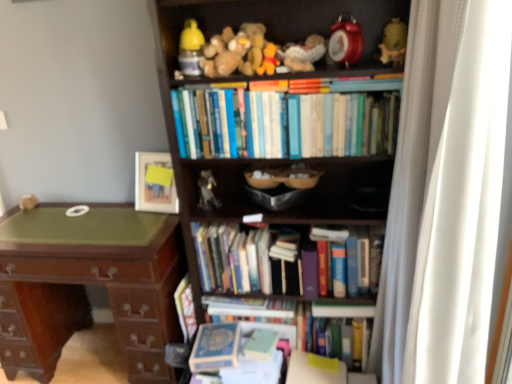
Image resolution: width=512 pixels, height=384 pixels. I want to click on wooden bookcase at center, so click(267, 159).

Locate an element on the screen. This screenshot has width=512, height=384. hardcover books at center, which is the first book from top to bottom is located at coordinates (286, 121).

In order to face metallic silver figurine at center, arranged as the 3th toy when viewed from the left, should I rotate leftwards or rightwards?

To face it directly, rotate left by 6.562 degrees.

This screenshot has width=512, height=384. Find the location of `metallic silver figurine at center, arranged as the 3th toy when viewed from the left`. metallic silver figurine at center, arranged as the 3th toy when viewed from the left is located at coordinates (207, 191).

At what (x,y) coordinates should I click in order to perform the action: click on matte yellow plastic bottle at upper center, which is the second toy from left to right. Please return your answer as a coordinate pair (x, y). The image size is (512, 384). Looking at the image, I should click on (191, 48).

Describe the element at coordinates (346, 41) in the screenshot. I see `shiny red alarm clock at upper right, marked as the second toy in a right-to-left arrangement` at that location.

Where is `brown plush bear at upper center, the 6th toy positioned from the right`? The image size is (512, 384). brown plush bear at upper center, the 6th toy positioned from the right is located at coordinates (224, 53).

Is green polished wood desk at left facing towards yellow rubber duck at upper center, arranged as the sixth toy when viewed from the left?

No.

From the image's perspective, is green polished wood desk at left located above yellow rubber duck at upper center, arranged as the sixth toy when viewed from the left?

No, from the image's perspective, green polished wood desk at left is not on top of yellow rubber duck at upper center, arranged as the sixth toy when viewed from the left.

Does green polished wood desk at left contain yellow rubber duck at upper center, the 4th toy viewed from the right?

Definitely not — yellow rubber duck at upper center, the 4th toy viewed from the right, is not inside green polished wood desk at left.

From their relative heights in the image, would you say fuzzy fabric teddy bear at upper center, marked as the 3th toy in a right-to-left arrangement, is taller or shorter than hardcover books at center, which is the 4th book from top to bottom?

Clearly, fuzzy fabric teddy bear at upper center, marked as the 3th toy in a right-to-left arrangement, is shorter compared to hardcover books at center, which is the 4th book from top to bottom.

Is fuzzy fabric teddy bear at upper center, marked as the 3th toy in a right-to-left arrangement, positioned with its back to hardcover books at center, the second book when ordered from bottom to top?

No, hardcover books at center, the second book when ordered from bottom to top, is not at the back of fuzzy fabric teddy bear at upper center, marked as the 3th toy in a right-to-left arrangement.

Does fuzzy fabric teddy bear at upper center, marked as the 3th toy in a right-to-left arrangement, have a lesser width compared to hardcover books at center, which is the 4th book from top to bottom?

Indeed, fuzzy fabric teddy bear at upper center, marked as the 3th toy in a right-to-left arrangement, has a lesser width compared to hardcover books at center, which is the 4th book from top to bottom.

From the image's perspective, which is above, fuzzy fabric teddy bear at upper center, marked as the 3th toy in a right-to-left arrangement, or hardcover books at center, the second book when ordered from bottom to top?

fuzzy fabric teddy bear at upper center, marked as the 3th toy in a right-to-left arrangement.

Based on the photo, measure the distance from yellow rubber duck at upper center, the 4th toy viewed from the right, to hardcover books at center, which is the first book from top to bottom.

The distance of yellow rubber duck at upper center, the 4th toy viewed from the right, from hardcover books at center, which is the first book from top to bottom, is 9.89 inches.

In the scene shown: Between yellow rubber duck at upper center, arranged as the sixth toy when viewed from the left, and hardcover books at center, marked as the fifth book in a bottom-to-top arrangement, which one has more height?

Standing taller between the two is hardcover books at center, marked as the fifth book in a bottom-to-top arrangement.

From the picture: Who is bigger, yellow rubber duck at upper center, arranged as the sixth toy when viewed from the left, or hardcover books at center, which is the first book from top to bottom?

hardcover books at center, which is the first book from top to bottom.

Is yellow rubber duck at upper center, arranged as the sixth toy when viewed from the left, facing away from hardcover books at center, marked as the fifth book in a bottom-to-top arrangement?

No.

Considering the relative sizes of brown plush bear at upper center, the 6th toy positioned from the right, and fuzzy fabric teddy bear at upper center, which is the seventh toy in left-to-right order, in the image provided, is brown plush bear at upper center, the 6th toy positioned from the right, smaller than fuzzy fabric teddy bear at upper center, which is the seventh toy in left-to-right order,?

No.

Are brown plush bear at upper center, the fourth toy in the left-to-right sequence, and fuzzy fabric teddy bear at upper center, which is the seventh toy in left-to-right order, located far from each other?

No, brown plush bear at upper center, the fourth toy in the left-to-right sequence, is not far from fuzzy fabric teddy bear at upper center, which is the seventh toy in left-to-right order.

I want to click on the 3rd toy to the right when counting from the brown plush bear at upper center, the 6th toy positioned from the right, so click(x=304, y=54).

Is brown plush bear at upper center, the 6th toy positioned from the right, positioned beyond the bounds of fuzzy fabric teddy bear at upper center, which is the seventh toy in left-to-right order?

Yes, brown plush bear at upper center, the 6th toy positioned from the right, is outside of fuzzy fabric teddy bear at upper center, which is the seventh toy in left-to-right order.

Considering the relative positions of yellow rubber duck at upper center, the 4th toy viewed from the right, and matte yellow ceramic vase at upper right, positioned as the ninth toy in left-to-right order, in the image provided, is yellow rubber duck at upper center, the 4th toy viewed from the right, to the left of matte yellow ceramic vase at upper right, positioned as the ninth toy in left-to-right order, from the viewer's perspective?

Correct, you'll find yellow rubber duck at upper center, the 4th toy viewed from the right, to the left of matte yellow ceramic vase at upper right, positioned as the ninth toy in left-to-right order.

I want to click on toy that is the 2nd object located behind the yellow rubber duck at upper center, arranged as the sixth toy when viewed from the left, so click(x=394, y=43).

Can you confirm if yellow rubber duck at upper center, the 4th toy viewed from the right, is wider than matte yellow ceramic vase at upper right, the first toy when ordered from right to left?

Incorrect, the width of yellow rubber duck at upper center, the 4th toy viewed from the right, does not surpass that of matte yellow ceramic vase at upper right, the first toy when ordered from right to left.

From the image's perspective, which one is positioned lower, matte wooden picture frame at upper center or fuzzy fabric stuffed animal at upper center, arranged as the fifth toy when viewed from the right?

matte wooden picture frame at upper center appears lower in the image.

How different are the orientations of matte wooden picture frame at upper center and fuzzy fabric stuffed animal at upper center, the 5th toy positioned from the left, in degrees?

7.75 degrees separate the facing orientations of matte wooden picture frame at upper center and fuzzy fabric stuffed animal at upper center, the 5th toy positioned from the left.

Considering the relative positions of matte wooden picture frame at upper center and fuzzy fabric stuffed animal at upper center, the 5th toy positioned from the left, in the image provided, is matte wooden picture frame at upper center behind fuzzy fabric stuffed animal at upper center, the 5th toy positioned from the left,?

Yes, matte wooden picture frame at upper center is behind fuzzy fabric stuffed animal at upper center, the 5th toy positioned from the left.

From the image's perspective, is white fabric curtain at right located above or below hardcover books at center, the 4th book when ordered from bottom to top?

From the image's perspective, white fabric curtain at right appears above hardcover books at center, the 4th book when ordered from bottom to top.

Is white fabric curtain at right facing away from hardcover books at center, the 2th book viewed from the top?

That's not correct — white fabric curtain at right is not looking away from hardcover books at center, the 2th book viewed from the top.

Is white fabric curtain at right far from hardcover books at center, the 4th book when ordered from bottom to top?

white fabric curtain at right is near hardcover books at center, the 4th book when ordered from bottom to top, not far away.

Can you confirm if white fabric curtain at right is smaller than hardcover books at center, the 4th book when ordered from bottom to top?

No, white fabric curtain at right is not smaller than hardcover books at center, the 4th book when ordered from bottom to top.

Where is `the 3rd toy above the green polished wood desk at left (from the image's perspective)`? Image resolution: width=512 pixels, height=384 pixels. the 3rd toy above the green polished wood desk at left (from the image's perspective) is located at coordinates (268, 60).

Image resolution: width=512 pixels, height=384 pixels. Identify the location of book that is the 4th one when counting downward from the fuzzy fabric teddy bear at upper center, which is the seventh toy in left-to-right order (from the image's perspective). (288, 316).

When comparing their distances from shiny red alarm clock at upper right, marked as the second toy in a right-to-left arrangement, does white fabric curtain at right or matte yellow plastic bottle at upper center, which is the second toy from left to right, seem closer?

matte yellow plastic bottle at upper center, which is the second toy from left to right, lies closer to shiny red alarm clock at upper right, marked as the second toy in a right-to-left arrangement, than the other object.

When comparing their distances from brown plush bear at upper center, the 6th toy positioned from the right, does hardcover books at center, the 4th book when ordered from bottom to top, or hardcover books at center, the second book when ordered from bottom to top, seem closer?

hardcover books at center, the 4th book when ordered from bottom to top, lies closer to brown plush bear at upper center, the 6th toy positioned from the right, than the other object.

From the image, which object appears to be farther from wooden bookcase at center, white fabric curtain at right or hardcover books at center, which is the first book from top to bottom?

Among the two, white fabric curtain at right is located further to wooden bookcase at center.

Consider the image. Which object lies nearer to the anchor point shiny red alarm clock at upper right, marked as the second toy in a right-to-left arrangement, matte yellow ceramic vase at upper right, the first toy when ordered from right to left, or green polished wood desk at left?

matte yellow ceramic vase at upper right, the first toy when ordered from right to left.

Looking at the image, which one is located closer to white fabric curtain at right, green polished wood desk at left or hardcover book at center, which appears as the third book when viewed from the top?

hardcover book at center, which appears as the third book when viewed from the top, is closer to white fabric curtain at right.

Which object lies nearer to the anchor point hardcover books at center, which is the 4th book from top to bottom, fuzzy fabric stuffed animal at upper center, the 5th toy positioned from the left, or yellow rubber duck at upper center, the 4th toy viewed from the right?

yellow rubber duck at upper center, the 4th toy viewed from the right, is closer to hardcover books at center, which is the 4th book from top to bottom.

Looking at the image, which one is located further to wooden bookcase at center, matte yellow ceramic vase at upper right, positioned as the ninth toy in left-to-right order, or hardcover books at center, the second book when ordered from bottom to top?

Based on the image, hardcover books at center, the second book when ordered from bottom to top, appears to be further to wooden bookcase at center.

When comparing their distances from metallic silver figurine at center, arranged as the 3th toy when viewed from the left, does matte wooden picture frame at upper center or matte yellow plastic bottle at upper center, which is the second toy from left to right, seem closer?

The object closer to metallic silver figurine at center, arranged as the 3th toy when viewed from the left, is matte wooden picture frame at upper center.

Where is `bookcase between matte yellow ceramic vase at upper right, positioned as the ninth toy in left-to-right order, and hardcover book at center, which is counted as the third book, starting from the bottom, from top to bottom`? This screenshot has height=384, width=512. bookcase between matte yellow ceramic vase at upper right, positioned as the ninth toy in left-to-right order, and hardcover book at center, which is counted as the third book, starting from the bottom, from top to bottom is located at coordinates (267, 159).

Where is `desk between fuzzy fabric teddy bear at upper center, marked as the 3th toy in a right-to-left arrangement, and hardcover book at center, which is counted as the third book, starting from the bottom, vertically`? This screenshot has height=384, width=512. desk between fuzzy fabric teddy bear at upper center, marked as the 3th toy in a right-to-left arrangement, and hardcover book at center, which is counted as the third book, starting from the bottom, vertically is located at coordinates (87, 283).

The height and width of the screenshot is (384, 512). I want to click on book between matte yellow plastic bottle at upper center, which is the eighth toy in right-to-left order, and wooden bookcase at center, in the vertical direction, so click(x=286, y=121).

At what (x,y) coordinates should I click in order to perform the action: click on desk that lies between fuzzy fabric teddy bear at upper center, which is the seventh toy in left-to-right order, and hardcover books at center, the second book when ordered from bottom to top, from top to bottom. Please return your answer as a coordinate pair (x, y). Image resolution: width=512 pixels, height=384 pixels. Looking at the image, I should click on (87, 283).